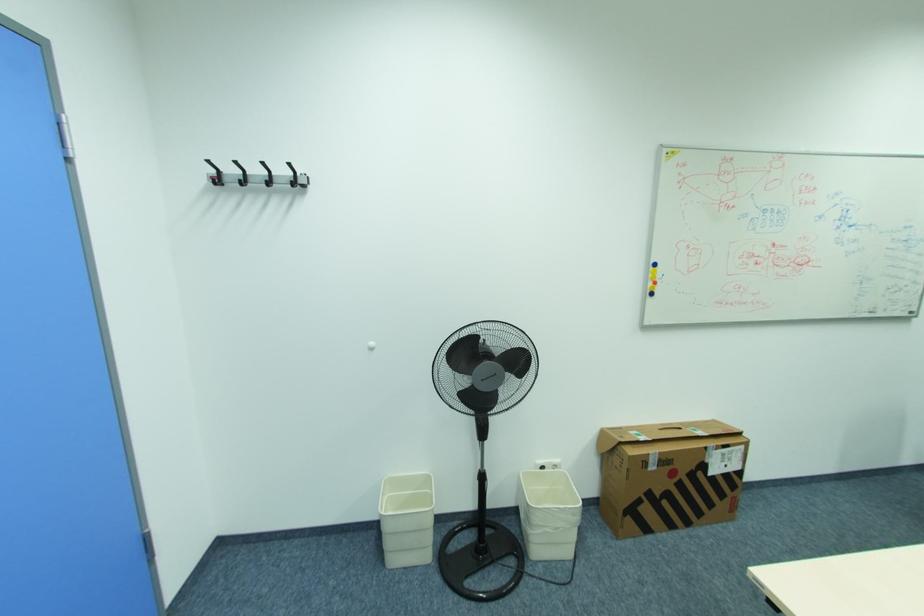
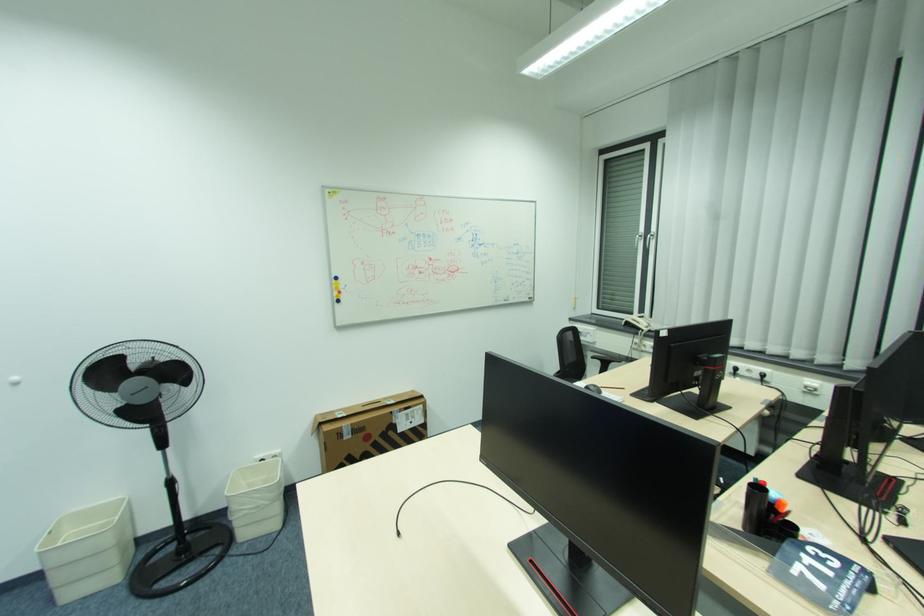
Find the pixel in the second image that matches (657,269) in the first image.

(339, 282)